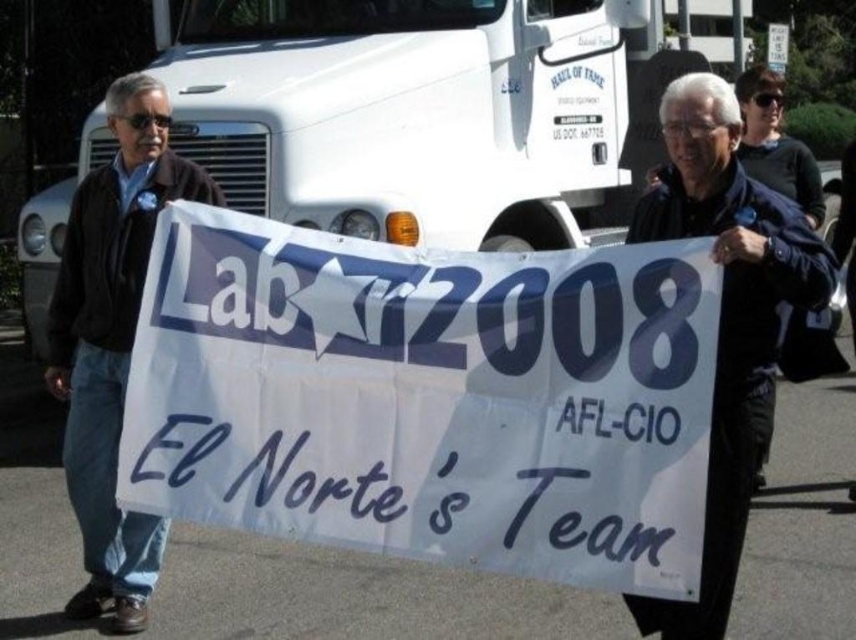
Is black leather jacket at center positioned behind dark brown leather jacket at left?

That is False.

Image resolution: width=856 pixels, height=640 pixels. What do you see at coordinates (727, 320) in the screenshot?
I see `black leather jacket at center` at bounding box center [727, 320].

Find the location of a particular element. The width and height of the screenshot is (856, 640). black leather jacket at center is located at coordinates (727, 320).

Locate an element on the screen. Image resolution: width=856 pixels, height=640 pixels. black leather jacket at center is located at coordinates (727, 320).

Is point (360, 371) behind point (825, 298)?

No, it is in front of (825, 298).

Is white paper banner at center wider than black leather jacket at center?

Indeed, white paper banner at center has a greater width compared to black leather jacket at center.

What do you see at coordinates (428, 397) in the screenshot? Image resolution: width=856 pixels, height=640 pixels. I see `white paper banner at center` at bounding box center [428, 397].

This screenshot has width=856, height=640. I want to click on white paper banner at center, so click(x=428, y=397).

Who is lower down, white paper banner at center or dark brown leather jacket at left?

dark brown leather jacket at left is below.

Find the location of a particular element. The width and height of the screenshot is (856, 640). white paper banner at center is located at coordinates pyautogui.click(x=428, y=397).

Where is `white paper banner at center`? The height and width of the screenshot is (640, 856). white paper banner at center is located at coordinates (428, 397).